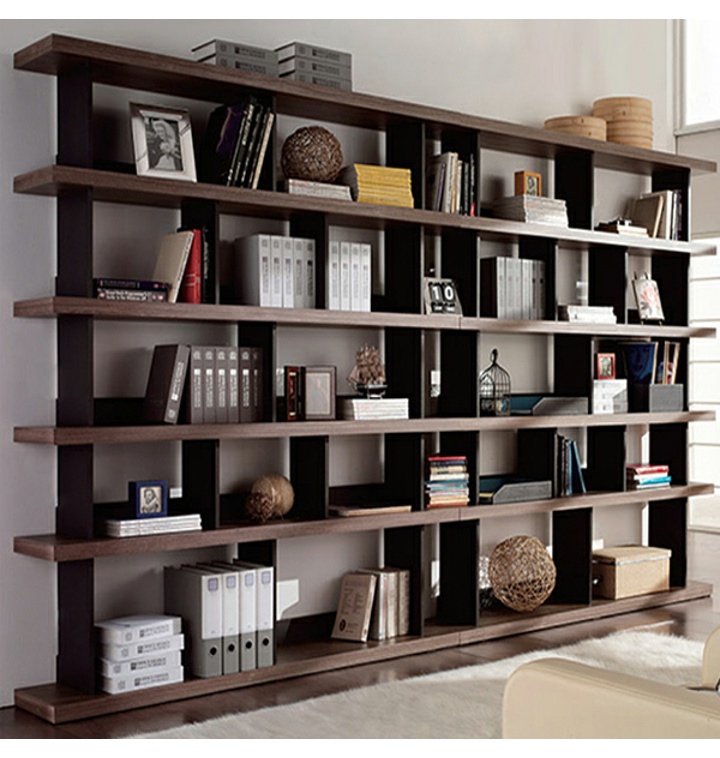
Where is `file baskets and storage boxes`? This screenshot has height=758, width=720. file baskets and storage boxes is located at coordinates (528, 484), (564, 409), (669, 392), (636, 568).